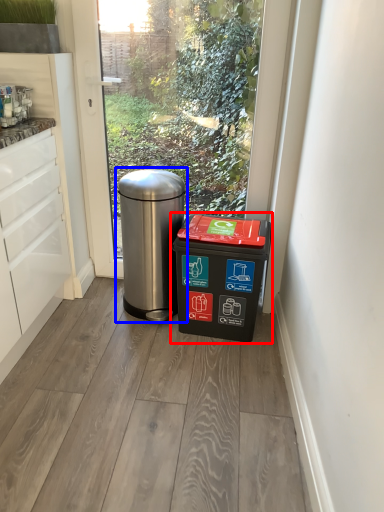
Question: Which of the following is the closest to the observer, waste container (highlighted by a red box) or waste container (highlighted by a blue box)?

Choices:
 (A) waste container
 (B) waste container

Answer: (A)